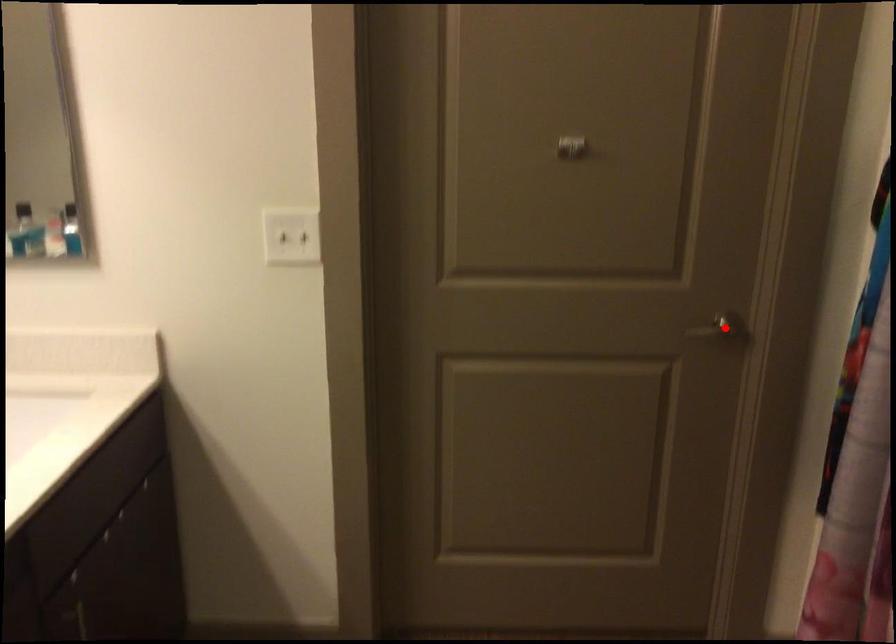
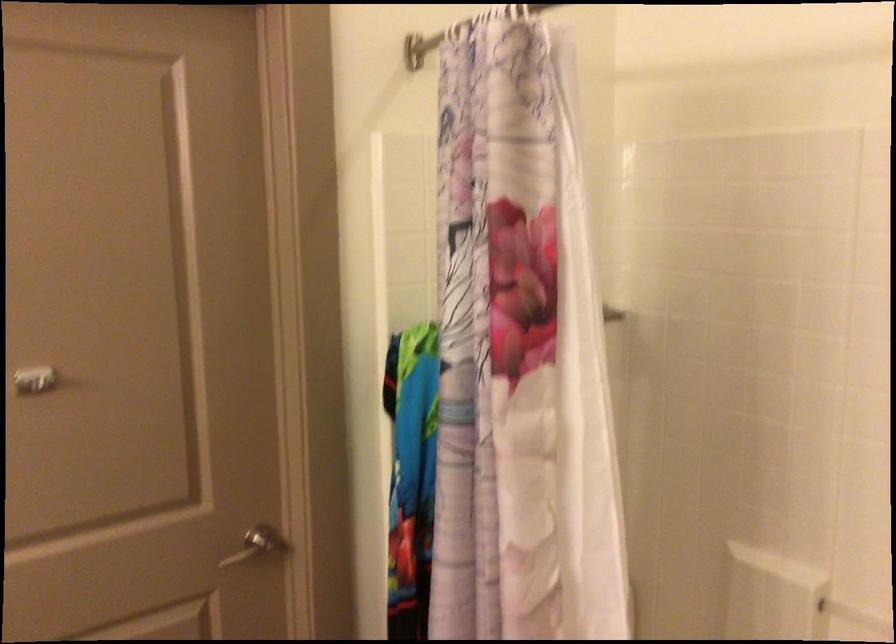
Where in the second image is the point corresponding to the highlighted location from the first image?

(257, 545)